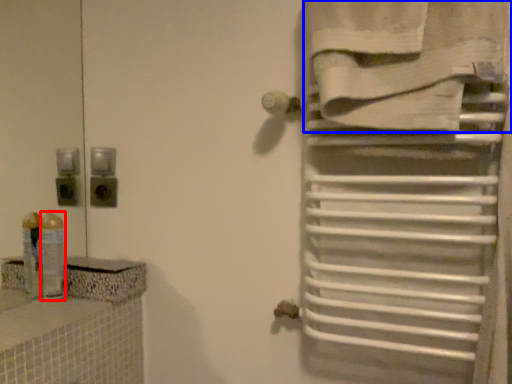
Question: Among these objects, which one is farthest to the camera, toiletry (highlighted by a red box) or towel (highlighted by a blue box)?

Choices:
 (A) toiletry
 (B) towel

Answer: (A)